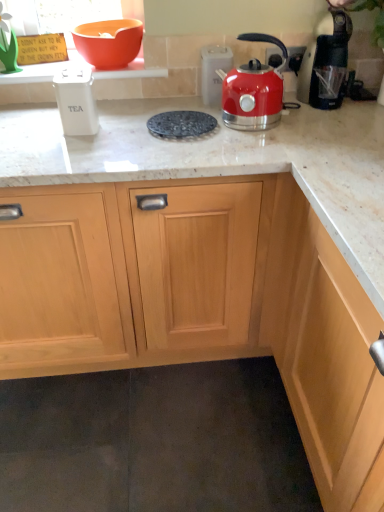
Question: Is orange matte bowl at upper left wider or thinner than metallic silver outlet at upper right?

Choices:
 (A) thin
 (B) wide

Answer: (B)

Question: From a real-world perspective, relative to metallic silver outlet at upper right, is orange matte bowl at upper left vertically above or below?

Choices:
 (A) above
 (B) below

Answer: (A)

Question: Estimate the real-world distances between objects in this image. Which object is farther from the orange matte bowl at upper left?

Choices:
 (A) metallic silver outlet at upper right
 (B) white plastic tea container at left, which appears as the 4th kitchen appliance when viewed from the right
 (C) black plastic coffee maker at upper right, the fourth kitchen appliance in the left-to-right sequence
 (D) shiny metallic kettle at upper right, the third kitchen appliance viewed from the left
 (E) white marble countertop at center

Answer: (C)

Question: Which object is positioned farthest from the orange matte bowl at upper left?

Choices:
 (A) metallic silver kettle at upper right, placed as the 2th kitchen appliance when sorted from left to right
 (B) shiny metallic kettle at upper right, the third kitchen appliance viewed from the left
 (C) white marble countertop at center
 (D) black textured trivet at center
 (E) black plastic coffee maker at upper right, the fourth kitchen appliance in the left-to-right sequence

Answer: (E)